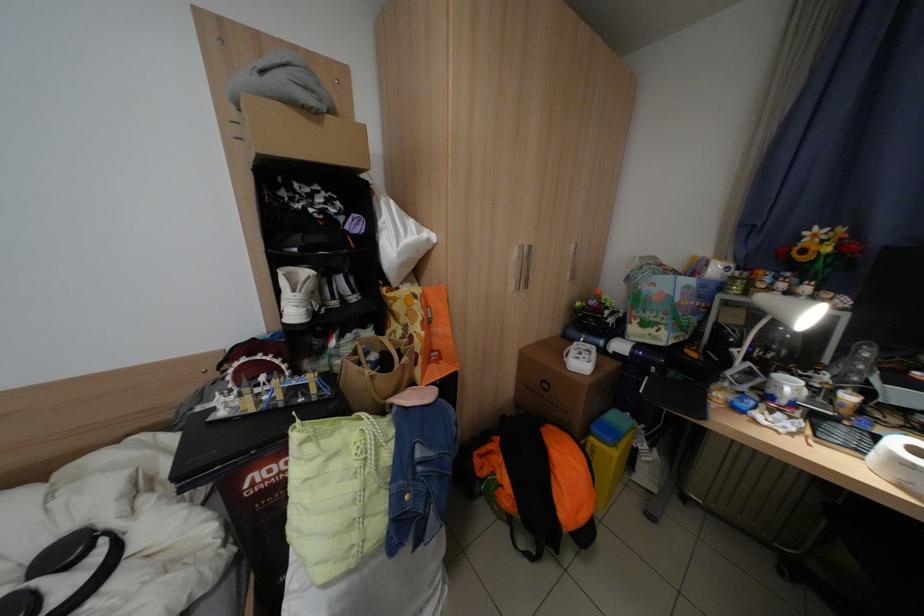
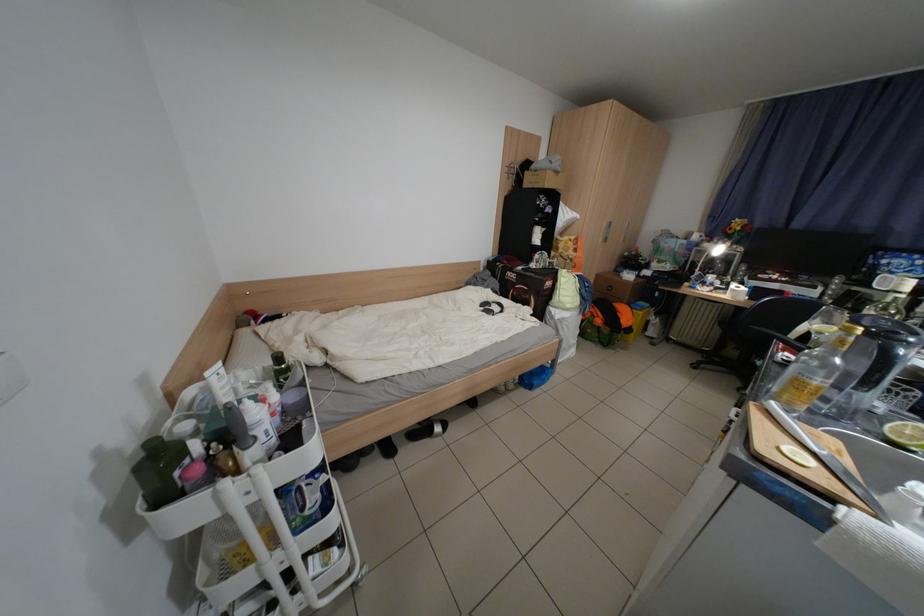
The images are taken continuously from a first-person perspective. In which direction are you moving?

The cameraman moved toward left, backward.